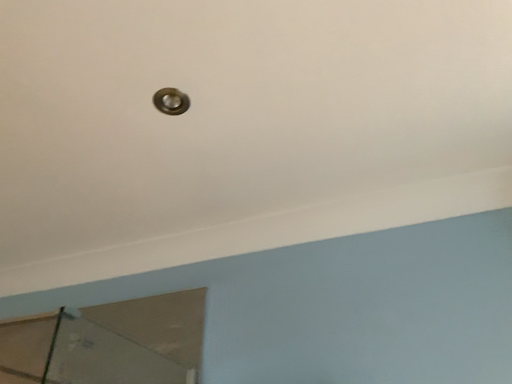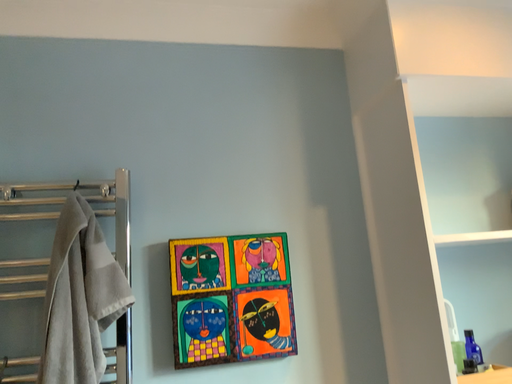
Question: Which way did the camera rotate in the video?

Choices:
 (A) rotated upward
 (B) rotated downward

Answer: (B)